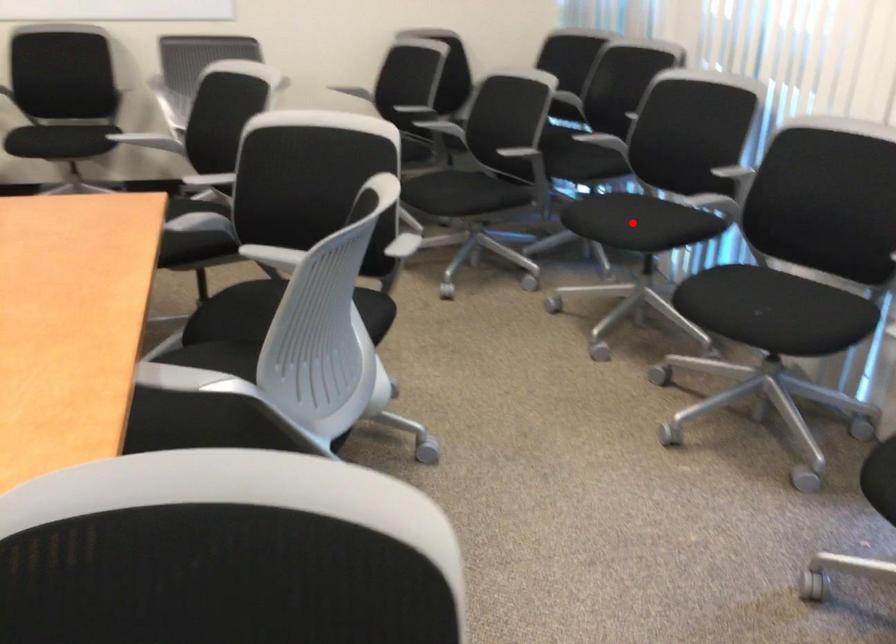
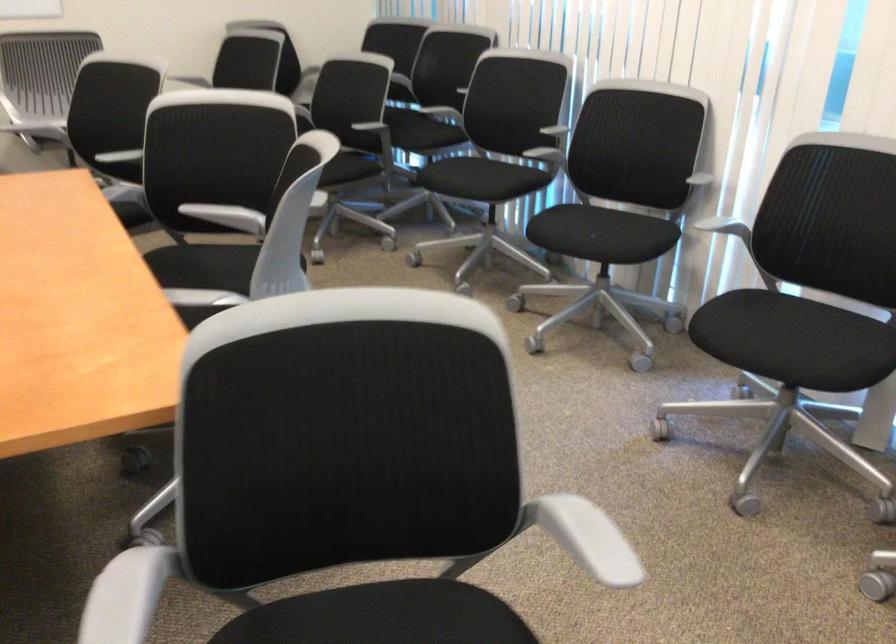
Question: A red point is marked in image1. In image2, is the corresponding 3D point closer to the camera or farther? Reply with the corresponding letter.

Choices:
 (A) The corresponding 3D point is closer.
 (B) The corresponding 3D point is farther.

Answer: (B)